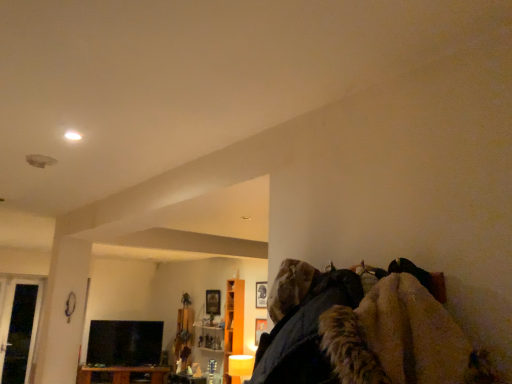
At what (x,y) coordinates should I click in order to perform the action: click on brown wood cabinet at lower left. Please return your answer as a coordinate pair (x, y). This screenshot has width=512, height=384. Looking at the image, I should click on (122, 374).

Consider the image. Measure the distance between point (11, 372) and camera.

A distance of 3.46 meters exists between point (11, 372) and camera.

Locate an element on the screen. orange wood cabinet at center is located at coordinates (233, 325).

Image resolution: width=512 pixels, height=384 pixels. In order to click on black glossy tv at lower left in this screenshot , I will do `click(123, 353)`.

This screenshot has height=384, width=512. In order to click on brown wood cabinet at lower left in this screenshot , I will do `click(122, 374)`.

What are the coordinates of `furniture behind the orange wood cabinet at center` in the screenshot? It's located at (122, 374).

What's the angular difference between orange wood cabinet at center and brown wood cabinet at lower left's facing directions?

58.3 degrees.

Considering the relative sizes of orange wood cabinet at center and brown wood cabinet at lower left in the image provided, is orange wood cabinet at center thinner than brown wood cabinet at lower left?

Correct, the width of orange wood cabinet at center is less than that of brown wood cabinet at lower left.

From a real-world perspective, is orange wood cabinet at center physically below brown wood cabinet at lower left?

Actually, orange wood cabinet at center is physically above brown wood cabinet at lower left in the real world.

Considering the positions of objects brown wood cabinet at lower left and black glossy tv at lower left in the image provided, who is more to the right, brown wood cabinet at lower left or black glossy tv at lower left?

From the viewer's perspective, brown wood cabinet at lower left appears more on the right side.

Is brown wood cabinet at lower left placed right next to black glossy tv at lower left?

There is a gap between brown wood cabinet at lower left and black glossy tv at lower left.

How many degrees apart are the facing directions of brown wood cabinet at lower left and black glossy tv at lower left?

The angle between the facing direction of brown wood cabinet at lower left and the facing direction of black glossy tv at lower left is 3.04 degrees.

Which is in front, brown wood cabinet at lower left or black glossy tv at lower left?

brown wood cabinet at lower left is closer to the camera.

Can you confirm if brown wood cabinet at lower left is smaller than orange wood cabinet at center?

Incorrect, brown wood cabinet at lower left is not smaller in size than orange wood cabinet at center.

Do you think brown wood cabinet at lower left is within orange wood cabinet at center, or outside of it?

brown wood cabinet at lower left is spatially situated outside orange wood cabinet at center.

Considering the relative sizes of brown wood cabinet at lower left and orange wood cabinet at center in the image provided, is brown wood cabinet at lower left shorter than orange wood cabinet at center?

Yes.

Where is `furniture lying on the left of orange wood cabinet at center`? The height and width of the screenshot is (384, 512). furniture lying on the left of orange wood cabinet at center is located at coordinates (122, 374).

Between transparent glass door at left and black glossy tv at lower left, which one has more height?

transparent glass door at left is taller.

From the image's perspective, between transparent glass door at left and black glossy tv at lower left, who is located below?

black glossy tv at lower left appears lower in the image.

Could you tell me if transparent glass door at left is facing black glossy tv at lower left?

No, transparent glass door at left is not turned towards black glossy tv at lower left.

Does transparent glass door at left turn towards brown wood cabinet at lower left?

No.

Is transparent glass door at left placed right next to brown wood cabinet at lower left?

There is a gap between transparent glass door at left and brown wood cabinet at lower left.

Does transparent glass door at left have a lesser width compared to brown wood cabinet at lower left?

Indeed, transparent glass door at left has a lesser width compared to brown wood cabinet at lower left.

How many degrees apart are the facing directions of transparent glass door at left and brown wood cabinet at lower left?

31.7 degrees separate the facing orientations of transparent glass door at left and brown wood cabinet at lower left.

Would you say black glossy tv at lower left is a long distance from brown wood cabinet at lower left?

No, there isn't a large distance between black glossy tv at lower left and brown wood cabinet at lower left.

How much distance is there between black glossy tv at lower left and brown wood cabinet at lower left?

The distance of black glossy tv at lower left from brown wood cabinet at lower left is 7.73 inches.

Can you tell me how much black glossy tv at lower left and brown wood cabinet at lower left differ in facing direction?

There is a 3.04-degree angle between the facing directions of black glossy tv at lower left and brown wood cabinet at lower left.

Between black glossy tv at lower left and brown wood cabinet at lower left, which one has more height?

With more height is black glossy tv at lower left.

Is transparent glass door at left in contact with orange wood cabinet at center?

No.

Which is behind, transparent glass door at left or orange wood cabinet at center?

transparent glass door at left is behind.

Considering the positions of objects transparent glass door at left and orange wood cabinet at center in the image provided, who is more to the left, transparent glass door at left or orange wood cabinet at center?

transparent glass door at left.

Is transparent glass door at left not within orange wood cabinet at center?

That's correct, transparent glass door at left is outside of orange wood cabinet at center.

Locate an element on the screen. The width and height of the screenshot is (512, 384). furniture that appears below the orange wood cabinet at center (from a real-world perspective) is located at coordinates pos(122,374).

Where is `entertainment center that is on the left side of brown wood cabinet at lower left`? entertainment center that is on the left side of brown wood cabinet at lower left is located at coordinates (123, 353).

Considering their positions, is orange wood cabinet at center positioned closer to brown wood cabinet at lower left than black glossy tv at lower left?

Among the two, black glossy tv at lower left is located nearer to brown wood cabinet at lower left.

Which object lies further to the anchor point black glossy tv at lower left, brown wood cabinet at lower left or orange wood cabinet at center?

Among the two, orange wood cabinet at center is located further to black glossy tv at lower left.

From the image, which object appears to be farther from transparent glass door at left, orange wood cabinet at center or black glossy tv at lower left?

The object further to transparent glass door at left is orange wood cabinet at center.

From the image, which object appears to be nearer to brown wood cabinet at lower left, orange wood cabinet at center or transparent glass door at left?

orange wood cabinet at center lies closer to brown wood cabinet at lower left than the other object.

Which object lies nearer to the anchor point orange wood cabinet at center, brown wood cabinet at lower left or transparent glass door at left?

brown wood cabinet at lower left is closer to orange wood cabinet at center.

Which object lies nearer to the anchor point brown wood cabinet at lower left, black glossy tv at lower left or orange wood cabinet at center?

black glossy tv at lower left is closer to brown wood cabinet at lower left.

Which object lies further to the anchor point transparent glass door at left, black glossy tv at lower left or orange wood cabinet at center?

Among the two, orange wood cabinet at center is located further to transparent glass door at left.

Consider the image. From the image, which object appears to be farther from transparent glass door at left, brown wood cabinet at lower left or orange wood cabinet at center?

The object further to transparent glass door at left is orange wood cabinet at center.

This screenshot has width=512, height=384. In order to click on furniture located between transparent glass door at left and orange wood cabinet at center in the left-right direction in this screenshot , I will do `click(122, 374)`.

Locate an element on the screen. furniture situated between black glossy tv at lower left and orange wood cabinet at center from left to right is located at coordinates (122, 374).

The height and width of the screenshot is (384, 512). In order to click on entertainment center situated between transparent glass door at left and orange wood cabinet at center from left to right in this screenshot , I will do `click(123, 353)`.

At what (x,y) coordinates should I click in order to perform the action: click on entertainment center situated between transparent glass door at left and brown wood cabinet at lower left from left to right. Please return your answer as a coordinate pair (x, y). Looking at the image, I should click on (123, 353).